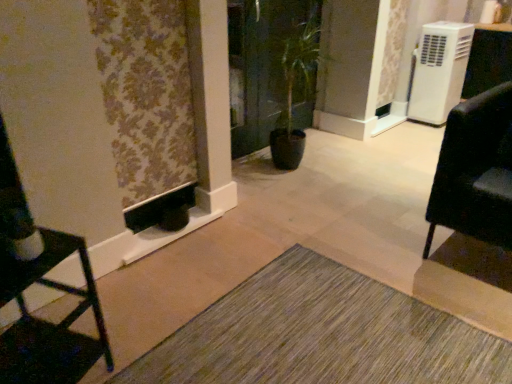
What do you see at coordinates (56, 289) in the screenshot? I see `matte black chair at left, the second furniture when ordered from back to front` at bounding box center [56, 289].

At what (x,y) coordinates should I click in order to perform the action: click on floral fabric curtain at left. Please return your answer as a coordinate pair (x, y). This screenshot has width=512, height=384. Looking at the image, I should click on (146, 93).

From the image's perspective, relative to green glossy screen door at center, is black leather chair at right, the 1th furniture positioned from the right, above or below?

black leather chair at right, the 1th furniture positioned from the right, is situated lower than green glossy screen door at center in the image.

Is point (464, 177) behind point (245, 98)?

No, it is in front of (245, 98).

Which object is wider, black leather chair at right, which appears as the second furniture when viewed from the front, or green glossy screen door at center?

Wider between the two is black leather chair at right, which appears as the second furniture when viewed from the front.

Is green glossy screen door at center at the back of black leather chair at right, which appears as the second furniture when viewed from the front?

No, green glossy screen door at center is not at the back of black leather chair at right, which appears as the second furniture when viewed from the front.

Between black leather chair at right, the 2th furniture viewed from the left, and matte black chair at left, the second furniture when ordered from right to left, which one appears on the right side from the viewer's perspective?

Positioned to the right is black leather chair at right, the 2th furniture viewed from the left.

Identify the location of furniture that appears above the matte black chair at left, acting as the first furniture starting from the left (from the image's perspective). (475, 171).

Which object is more forward, black leather chair at right, the 1th furniture positioned from the right, or matte black chair at left, the second furniture when ordered from right to left?

matte black chair at left, the second furniture when ordered from right to left, is in front.

Is black leather chair at right, which appears as the second furniture when viewed from the front, looking in the opposite direction of matte black chair at left, acting as the first furniture starting from the left?

No, black leather chair at right, which appears as the second furniture when viewed from the front, is not facing away from matte black chair at left, acting as the first furniture starting from the left.

Is green glossy screen door at center not inside green textured mat at lower center?

Yes.

From a real-world perspective, which is physically above, green glossy screen door at center or green textured mat at lower center?

In real-world perspective, green glossy screen door at center is above.

Does green glossy screen door at center have a greater width compared to green textured mat at lower center?

In fact, green glossy screen door at center might be narrower than green textured mat at lower center.

Between matte black chair at left, acting as the first furniture starting from the left, and green textured mat at lower center, which one has larger width?

green textured mat at lower center is wider.

Can green textured mat at lower center be found inside matte black chair at left, acting as the first furniture starting from the left?

Definitely not — green textured mat at lower center is not inside matte black chair at left, acting as the first furniture starting from the left.

Find the location of `doormat lying on the right of matte black chair at left, acting as the first furniture starting from the front`. doormat lying on the right of matte black chair at left, acting as the first furniture starting from the front is located at coordinates (321, 335).

Between point (294, 333) and point (160, 112), which one is positioned in front?

Point (294, 333)

Considering the sizes of green textured mat at lower center and floral fabric curtain at left in the image, is green textured mat at lower center bigger or smaller than floral fabric curtain at left?

green textured mat at lower center is smaller than floral fabric curtain at left.

Is green glossy screen door at center completely or partially inside floral fabric curtain at left?

Actually, green glossy screen door at center is outside floral fabric curtain at left.

From the image's perspective, which one is positioned higher, floral fabric curtain at left or green glossy screen door at center?

From the image's view, green glossy screen door at center is above.

Does floral fabric curtain at left appear on the right side of green glossy screen door at center?

In fact, floral fabric curtain at left is to the left of green glossy screen door at center.

This screenshot has height=384, width=512. Identify the location of doormat to the left of green glossy screen door at center. (321, 335).

Are green textured mat at lower center and green glossy screen door at center far apart?

green textured mat at lower center is far away from green glossy screen door at center.

From a real-world perspective, is green textured mat at lower center above or below green glossy screen door at center?

In terms of real-world spatial position, green textured mat at lower center is below green glossy screen door at center.

Locate an element on the screen. The height and width of the screenshot is (384, 512). furniture that is the 1st object located below the green glossy screen door at center (from the image's perspective) is located at coordinates (475, 171).

I want to click on furniture that appears below the black leather chair at right, the 1th furniture positioned from the right (from a real-world perspective), so click(x=56, y=289).

Which object lies further to the anchor point white plastic air conditioner at upper right, green textured mat at lower center or matte black chair at left, the second furniture when ordered from right to left?

Based on the image, matte black chair at left, the second furniture when ordered from right to left, appears to be further to white plastic air conditioner at upper right.

From the image, which object appears to be nearer to matte black chair at left, the second furniture when ordered from back to front, green glossy screen door at center or green textured mat at lower center?

green textured mat at lower center is positioned closer to the anchor matte black chair at left, the second furniture when ordered from back to front.

From the image, which object appears to be nearer to green textured mat at lower center, green glossy screen door at center or white plastic air conditioner at upper right?

Among the two, green glossy screen door at center is located nearer to green textured mat at lower center.

From the picture: Which object lies nearer to the anchor point white plastic air conditioner at upper right, matte black chair at left, the second furniture when ordered from right to left, or black leather chair at right, which appears as the second furniture when viewed from the front?

black leather chair at right, which appears as the second furniture when viewed from the front, lies closer to white plastic air conditioner at upper right than the other object.

Which object lies nearer to the anchor point green textured mat at lower center, matte black chair at left, acting as the first furniture starting from the front, or green glossy screen door at center?

The object closer to green textured mat at lower center is matte black chair at left, acting as the first furniture starting from the front.

Which object lies nearer to the anchor point green textured mat at lower center, black leather chair at right, which is the first furniture from back to front, or green glossy screen door at center?

black leather chair at right, which is the first furniture from back to front, is closer to green textured mat at lower center.

Based on their spatial positions, is floral fabric curtain at left or green glossy screen door at center further from matte black chair at left, the second furniture when ordered from right to left?

Among the two, green glossy screen door at center is located further to matte black chair at left, the second furniture when ordered from right to left.

In the scene shown: When comparing their distances from floral fabric curtain at left, does white plastic air conditioner at upper right or black leather chair at right, the 2th furniture viewed from the left, seem closer?

black leather chair at right, the 2th furniture viewed from the left, lies closer to floral fabric curtain at left than the other object.

Locate an element on the screen. furniture between floral fabric curtain at left and white plastic air conditioner at upper right from left to right is located at coordinates (475, 171).

Image resolution: width=512 pixels, height=384 pixels. In order to click on curtain situated between matte black chair at left, the second furniture when ordered from right to left, and white plastic air conditioner at upper right from left to right in this screenshot , I will do `click(146, 93)`.

What are the coordinates of `furniture situated between matte black chair at left, the second furniture when ordered from back to front, and white plastic air conditioner at upper right from left to right` in the screenshot? It's located at (475, 171).

In order to click on curtain positioned between green textured mat at lower center and white plastic air conditioner at upper right from near to far in this screenshot , I will do `click(146, 93)`.